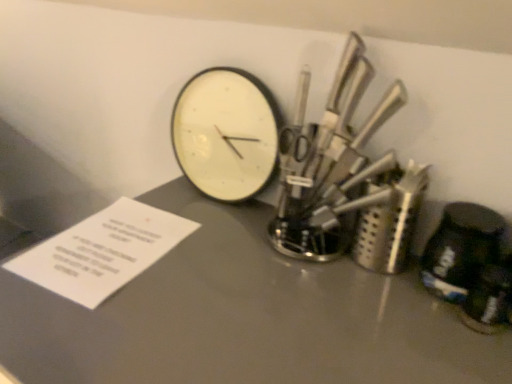
Find the location of a particular element. vacant space in between white matte wall clock at center and polished metal knife set at upper right is located at coordinates (229, 221).